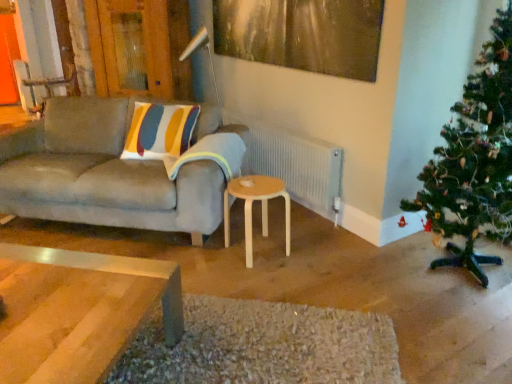
Question: Can you confirm if metallic gold painting at upper center is shorter than striped fabric pillow at center?

Choices:
 (A) yes
 (B) no

Answer: (B)

Question: Does metallic gold painting at upper center touch striped fabric pillow at center?

Choices:
 (A) no
 (B) yes

Answer: (A)

Question: From the image's perspective, is metallic gold painting at upper center below striped fabric pillow at center?

Choices:
 (A) yes
 (B) no

Answer: (B)

Question: Is metallic gold painting at upper center behind striped fabric pillow at center?

Choices:
 (A) yes
 (B) no

Answer: (B)

Question: Can you confirm if metallic gold painting at upper center is wider than striped fabric pillow at center?

Choices:
 (A) no
 (B) yes

Answer: (A)

Question: Based on their positions, is white textured radiator at center located to the left or right of natural wood stool at center?

Choices:
 (A) left
 (B) right

Answer: (B)

Question: From a real-world perspective, relative to natural wood stool at center, is white textured radiator at center vertically above or below?

Choices:
 (A) below
 (B) above

Answer: (B)

Question: Would you say white textured radiator at center is inside or outside natural wood stool at center?

Choices:
 (A) inside
 (B) outside

Answer: (B)

Question: Is point (330, 185) positioned closer to the camera than point (258, 193)?

Choices:
 (A) farther
 (B) closer

Answer: (A)

Question: Is point (486, 221) positioned closer to the camera than point (70, 130)?

Choices:
 (A) closer
 (B) farther

Answer: (A)

Question: Looking at their shapes, would you say green textured christmas tree at right is wider or thinner than matte gray couch at left?

Choices:
 (A) thin
 (B) wide

Answer: (A)

Question: In the image, is green textured christmas tree at right on the left side or the right side of matte gray couch at left?

Choices:
 (A) right
 (B) left

Answer: (A)

Question: Considering their positions, is green textured christmas tree at right located in front of or behind matte gray couch at left?

Choices:
 (A) behind
 (B) front

Answer: (B)

Question: In terms of width, does white textured radiator at center look wider or thinner when compared to wooden armchair at upper left?

Choices:
 (A) wide
 (B) thin

Answer: (B)

Question: Considering the positions of point (303, 165) and point (56, 81), is point (303, 165) closer or farther from the camera than point (56, 81)?

Choices:
 (A) farther
 (B) closer

Answer: (B)